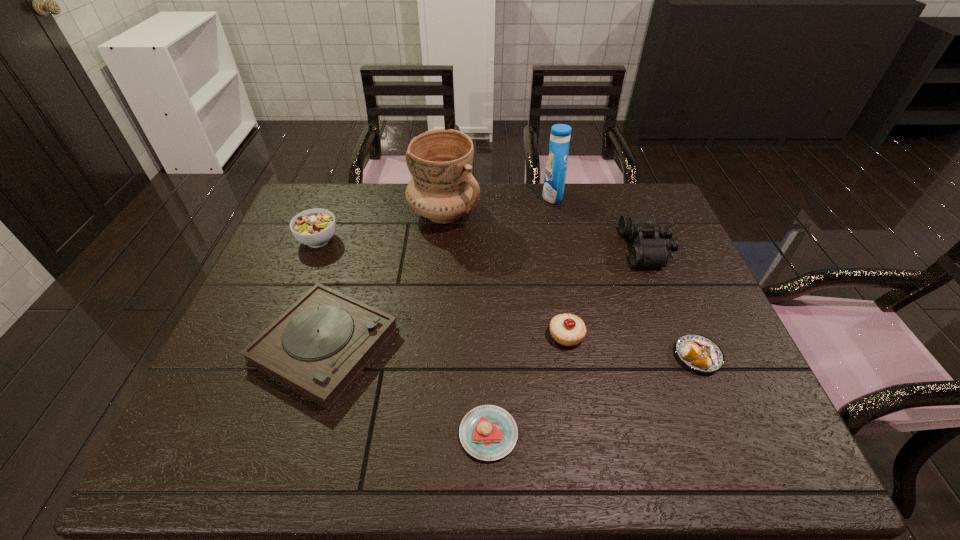
Image resolution: width=960 pixels, height=540 pixels. In order to click on detergent in this screenshot , I will do (555, 174).

Identify the location of pottery. (443, 189).

In order to click on binoculars in this screenshot , I will do `click(650, 249)`.

You are a GUI agent. You are given a task and a screenshot of the screen. Output one action in this format:
    pyautogui.click(x=<x>, y=<y>)
    Task: Click on the soup bowl
    This screenshot has height=540, width=960.
    Given the screenshot: What is the action you would take?
    pyautogui.click(x=315, y=227)

At what (x,y) coordinates should I click in order to perform the action: click on the tallest pastry. Please return your answer as a coordinate pair (x, y). The height and width of the screenshot is (540, 960). Looking at the image, I should click on (566, 329).

Find the location of a particular element. the third shortest object is located at coordinates (318, 347).

Locate an element on the screen. the rightmost pastry is located at coordinates (697, 352).

I want to click on the leftmost pastry, so click(487, 432).

At what (x,y) coordinates should I click in order to perform the action: click on free space located 0.130m on the front-facing side of the detergent. Please return your answer as a coordinate pair (x, y). The height and width of the screenshot is (540, 960). Looking at the image, I should click on pyautogui.click(x=505, y=196).

The width and height of the screenshot is (960, 540). I want to click on free space located 0.350m on the front-facing side of the detergent, so click(x=441, y=196).